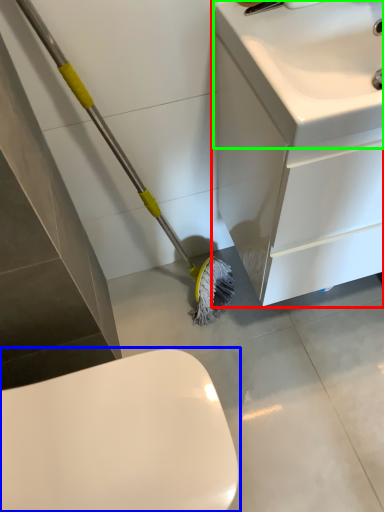
Question: Based on their relative distances, which object is farther from bathroom cabinet (highlighted by a red box)? Choose from toilet (highlighted by a blue box) and sink (highlighted by a green box).

Choices:
 (A) toilet
 (B) sink

Answer: (A)